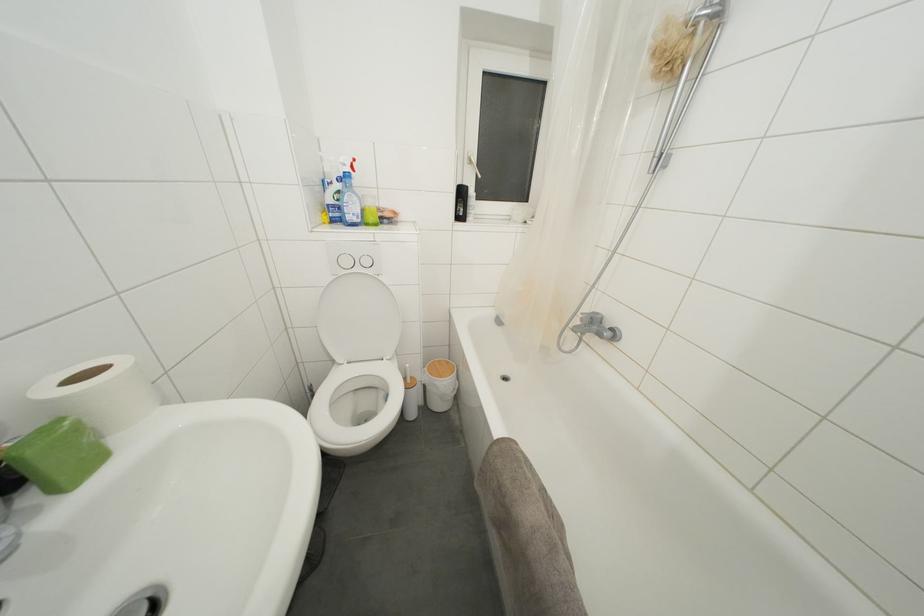
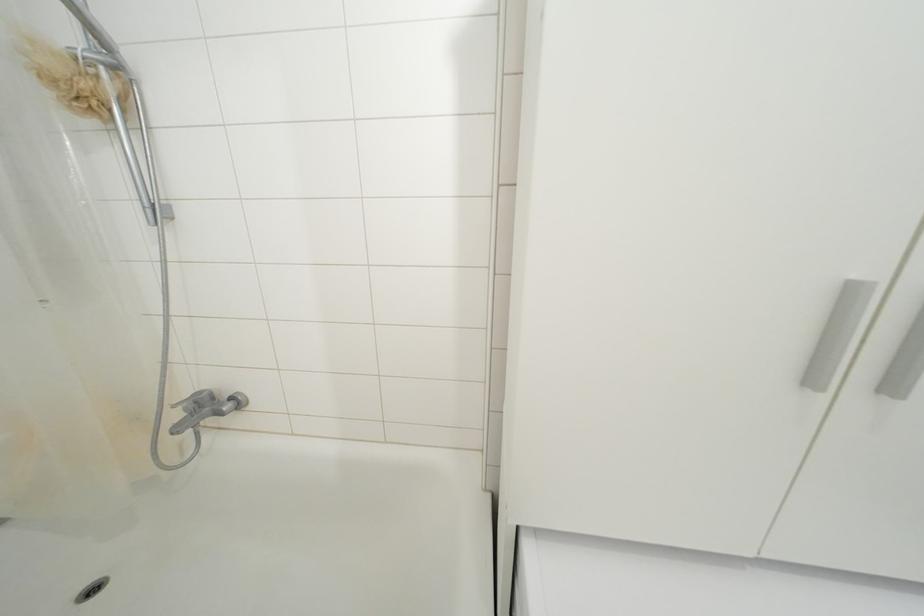
Locate, in the second image, the point that corresponds to (697,38) in the first image.

(100, 79)